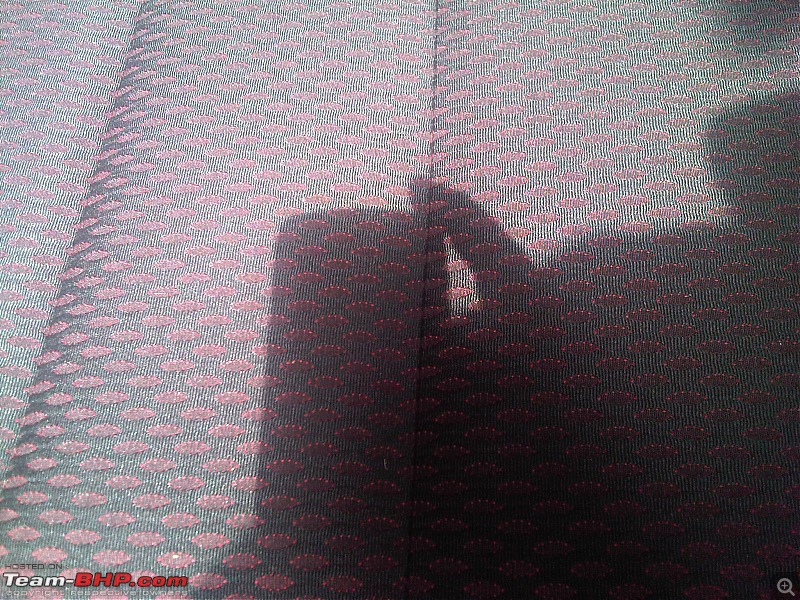
I want to click on couch, so click(x=642, y=162).